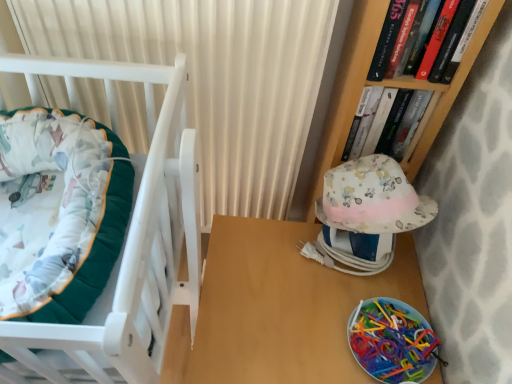
The width and height of the screenshot is (512, 384). I want to click on white textured curtain at upper center, so [x=220, y=81].

What do you see at coordinates (131, 240) in the screenshot? This screenshot has width=512, height=384. I see `velvet green cushion at left` at bounding box center [131, 240].

The height and width of the screenshot is (384, 512). Identify the location of velvet green cushion at left. (131, 240).

Describe the element at coordinates (392, 341) in the screenshot. I see `translucent plastic plate at lower right` at that location.

This screenshot has height=384, width=512. What do you see at coordinates (372, 198) in the screenshot? I see `fluffy cotton hat at right` at bounding box center [372, 198].

In order to click on hardcover book at upper right, which ranks as the second book in back-to-front order in this screenshot , I will do `click(448, 39)`.

In order to click on the 2nd book located above the white textured curtain at upper center (from a real-world perspective) in this screenshot , I will do `click(448, 39)`.

Can you confirm if hardcover book at upper right, which appears as the first book when viewed from the front, is thinner than white textured curtain at upper center?

Yes, hardcover book at upper right, which appears as the first book when viewed from the front, is thinner than white textured curtain at upper center.

Who is bigger, hardcover book at upper right, which appears as the first book when viewed from the front, or white textured curtain at upper center?

white textured curtain at upper center.

Considering the positions of point (306, 148) and point (188, 253), is point (306, 148) closer or farther from the camera than point (188, 253)?

Point (306, 148) is farther from the camera than point (188, 253).

Which object is further away from the camera, white textured curtain at upper center or velvet green cushion at left?

white textured curtain at upper center.

From the image's perspective, is white textured curtain at upper center under velvet green cushion at left?

Incorrect, from the image's perspective, white textured curtain at upper center is higher than velvet green cushion at left.

Could you tell me if white textured curtain at upper center is facing velvet green cushion at left?

Yes, white textured curtain at upper center is facing velvet green cushion at left.

Is fluffy cotton hat at right further to the viewer compared to hardcover book at upper right, marked as the first book in a back-to-front arrangement?

No, fluffy cotton hat at right is in front of hardcover book at upper right, marked as the first book in a back-to-front arrangement.

Is fluffy cotton hat at right outside of hardcover book at upper right, the second book positioned from the front?

fluffy cotton hat at right is positioned outside hardcover book at upper right, the second book positioned from the front.

Between fluffy cotton hat at right and hardcover book at upper right, the second book positioned from the front, which one has larger size?

With larger size is fluffy cotton hat at right.

From the image's perspective, is white textured curtain at upper center above translucent plastic plate at lower right?

Yes, from the image's perspective, white textured curtain at upper center is above translucent plastic plate at lower right.

Is white textured curtain at upper center turned away from translucent plastic plate at lower right?

white textured curtain at upper center is not turned away from translucent plastic plate at lower right.

Does point (210, 44) come closer to viewer compared to point (424, 367)?

Yes, point (210, 44) is in front of point (424, 367).

Is white textured curtain at upper center next to translucent plastic plate at lower right?

white textured curtain at upper center is not next to translucent plastic plate at lower right, and they're not touching.

Is the depth of translucent plastic plate at lower right greater than that of wooden table at center?

Yes, translucent plastic plate at lower right is further from the viewer.

Identify the location of table below the translucent plastic plate at lower right (from the image's perspective). coord(284,306).

Does point (376, 313) come in front of point (246, 357)?

No, it is not.

Does hardcover book at upper right, marked as the first book in a back-to-front arrangement, have a larger size compared to velvet green cushion at left?

Incorrect, hardcover book at upper right, marked as the first book in a back-to-front arrangement, is not larger than velvet green cushion at left.

Which is nearer, [417,113] or [176,270]?

The point [176,270] is closer.

Locate an element on the screen. Image resolution: width=512 pixels, height=384 pixels. furniture on the left of hardcover book at upper right, the second book positioned from the front is located at coordinates [x=131, y=240].

Is hardcover book at upper right, marked as the first book in a back-to-front arrangement, spatially inside velvet green cushion at left, or outside of it?

hardcover book at upper right, marked as the first book in a back-to-front arrangement, is spatially situated outside velvet green cushion at left.

Between point (140, 255) and point (233, 349), which one is positioned behind?

The point (233, 349) is more distant.

Where is `furniture that appears on the left of wooden table at center`? furniture that appears on the left of wooden table at center is located at coordinates (131, 240).

Based on the photo, considering the positions of objects velvet green cushion at left and wooden table at center in the image provided, who is in front, velvet green cushion at left or wooden table at center?

velvet green cushion at left is more forward.

Consider the image. Which of these two, velvet green cushion at left or wooden table at center, is smaller?

A: Smaller between the two is velvet green cushion at left.

Where is `the 2nd book counting from the right side of the white textured curtain at upper center`? the 2nd book counting from the right side of the white textured curtain at upper center is located at coordinates (448, 39).

The width and height of the screenshot is (512, 384). Find the location of `curtain behind the velvet green cushion at left`. curtain behind the velvet green cushion at left is located at coordinates (220, 81).

Estimate the real-world distances between objects in this image. Which object is closer to velvet green cushion at left, white textured curtain at upper center or translucent plastic plate at lower right?

Based on the image, white textured curtain at upper center appears to be nearer to velvet green cushion at left.

Based on their spatial positions, is velvet green cushion at left or white textured curtain at upper center further from translucent plastic plate at lower right?

Based on the image, white textured curtain at upper center appears to be further to translucent plastic plate at lower right.

When comparing their distances from white textured curtain at upper center, does hardcover book at upper right, the second book positioned from the front, or hardcover book at upper right, which ranks as the second book in back-to-front order, seem further?

hardcover book at upper right, which ranks as the second book in back-to-front order.

In the scene shown: Estimate the real-world distances between objects in this image. Which object is further from translucent plastic plate at lower right, hardcover book at upper right, marked as the first book in a back-to-front arrangement, or velvet green cushion at left?

velvet green cushion at left is positioned further to the anchor translucent plastic plate at lower right.

When comparing their distances from white textured curtain at upper center, does hardcover book at upper right, which appears as the first book when viewed from the front, or translucent plastic plate at lower right seem further?

Among the two, translucent plastic plate at lower right is located further to white textured curtain at upper center.

From the image, which object appears to be farther from velvet green cushion at left, fluffy cotton hat at right or wooden table at center?

fluffy cotton hat at right.

Looking at the image, which one is located further to hardcover book at upper right, marked as the first book in a back-to-front arrangement, translucent plastic plate at lower right or hardcover book at upper right, which appears as the first book when viewed from the front?

Based on the image, translucent plastic plate at lower right appears to be further to hardcover book at upper right, marked as the first book in a back-to-front arrangement.

From the image, which object appears to be nearer to fluffy cotton hat at right, wooden table at center or translucent plastic plate at lower right?

wooden table at center lies closer to fluffy cotton hat at right than the other object.

Identify the location of book that lies between hardcover book at upper right, which appears as the first book when viewed from the front, and translucent plastic plate at lower right from top to bottom. This screenshot has height=384, width=512. (392, 123).

The image size is (512, 384). What are the coordinates of `curtain between hardcover book at upper right, which ranks as the second book in back-to-front order, and translucent plastic plate at lower right in the up-down direction` in the screenshot? It's located at (220, 81).

This screenshot has width=512, height=384. Find the location of `hat between white textured curtain at upper center and hardcover book at upper right, marked as the first book in a back-to-front arrangement, in the horizontal direction`. hat between white textured curtain at upper center and hardcover book at upper right, marked as the first book in a back-to-front arrangement, in the horizontal direction is located at coordinates (372, 198).

The height and width of the screenshot is (384, 512). I want to click on furniture between white textured curtain at upper center and wooden table at center from top to bottom, so (x=131, y=240).